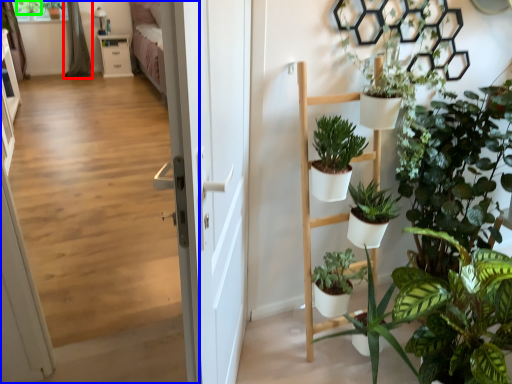
Question: Based on their relative distances, which object is farther from curtain (highlighted by a red box)? Choose from corridor (highlighted by a blue box) and plant (highlighted by a green box).

Choices:
 (A) corridor
 (B) plant

Answer: (A)